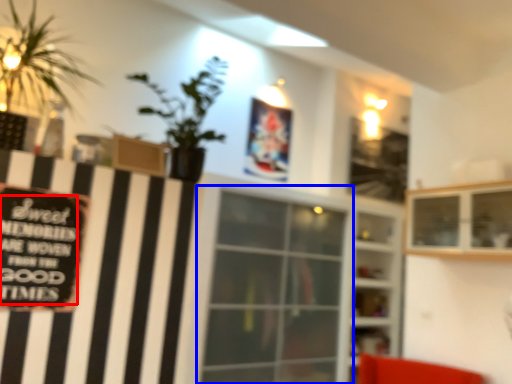
Question: Which object is closer to the camera taking this photo, writing (highlighted by a red box) or window (highlighted by a blue box)?

Choices:
 (A) writing
 (B) window

Answer: (A)